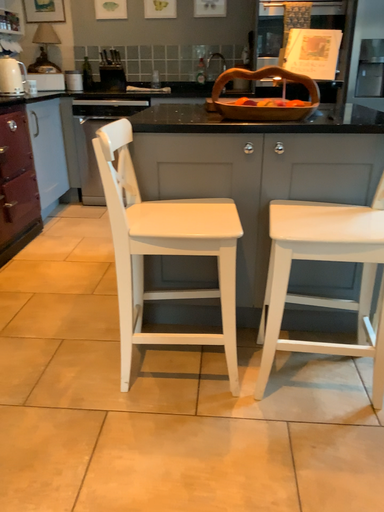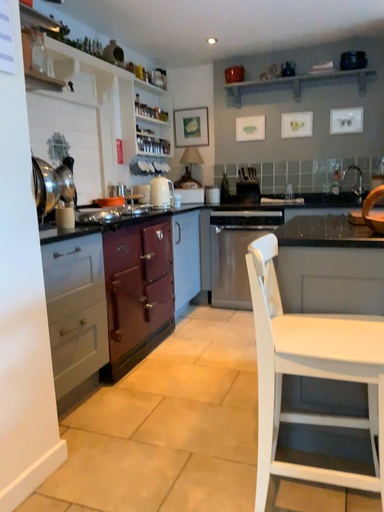
Question: How did the camera likely rotate when shooting the video?

Choices:
 (A) rotated left
 (B) rotated right

Answer: (A)